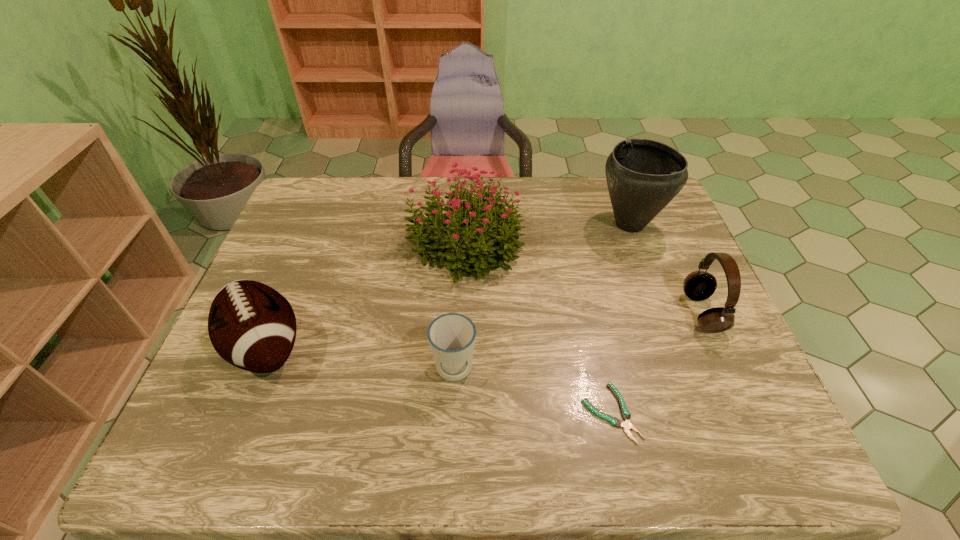
The height and width of the screenshot is (540, 960). What are the coordinates of `vacant space that is in between the urn and the bouquet` in the screenshot? It's located at (547, 234).

What are the coordinates of `vacant space that's between the urn and the bouquet` in the screenshot? It's located at (547, 234).

The height and width of the screenshot is (540, 960). What are the coordinates of `vacant area that lies between the headset and the fourth object from left to right` in the screenshot? It's located at (657, 362).

I want to click on vacant space that is in between the leftmost object and the urn, so click(447, 285).

Locate an element on the screen. Image resolution: width=960 pixels, height=540 pixels. free spot between the headset and the urn is located at coordinates (666, 268).

I want to click on unoccupied area between the bouquet and the urn, so click(x=547, y=234).

Image resolution: width=960 pixels, height=540 pixels. Find the location of `free area in between the shortest object and the urn`. free area in between the shortest object and the urn is located at coordinates (620, 318).

This screenshot has width=960, height=540. What are the coordinates of `vacant space that's between the second shortest object and the football (American)` in the screenshot? It's located at (360, 359).

Where is `object that is the second closest to the headset`? The image size is (960, 540). object that is the second closest to the headset is located at coordinates (626, 415).

Locate an element on the screen. The width and height of the screenshot is (960, 540). object that is the fourth closest one to the football (American) is located at coordinates (643, 176).